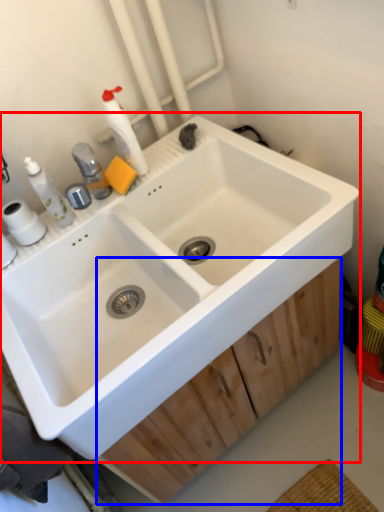
Question: Which object appears closest to the camera in this image, sink (highlighted by a red box) or drawer (highlighted by a blue box)?

Choices:
 (A) sink
 (B) drawer

Answer: (A)